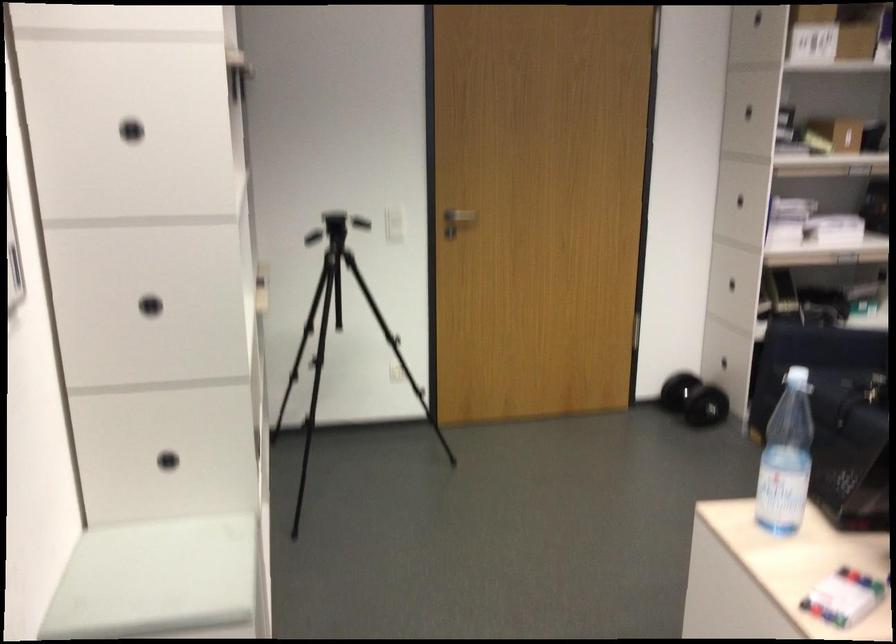
The image size is (896, 644). Find the location of `bench sitting surface`. bench sitting surface is located at coordinates (159, 581).